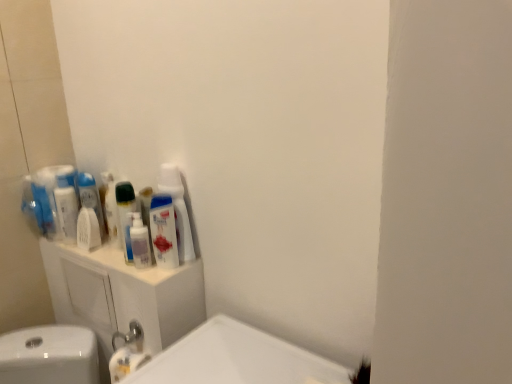
The height and width of the screenshot is (384, 512). In order to click on vacant space to the left of translucent plastic mouthwash at center, which is the fourth mouthwash from left to right in this screenshot , I will do `click(108, 262)`.